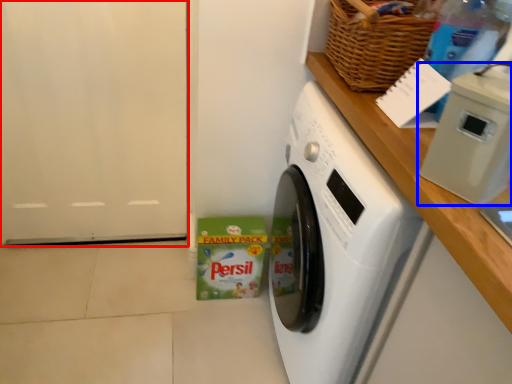
Question: Which of the following is the closest to the observer, door (highlighted by a red box) or appliance (highlighted by a blue box)?

Choices:
 (A) door
 (B) appliance

Answer: (B)